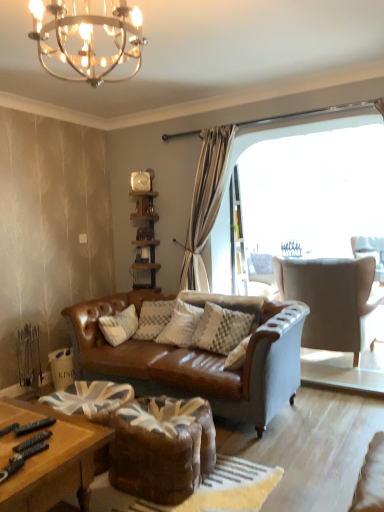
Question: Is suede-like beige armchair at right turned away from wooden polished coffee table at lower left?

Choices:
 (A) yes
 (B) no

Answer: (A)

Question: From a real-world perspective, is suede-like beige armchair at right physically above wooden polished coffee table at lower left?

Choices:
 (A) no
 (B) yes

Answer: (B)

Question: Is suede-like beige armchair at right shorter than wooden polished coffee table at lower left?

Choices:
 (A) no
 (B) yes

Answer: (A)

Question: Is suede-like beige armchair at right smaller than wooden polished coffee table at lower left?

Choices:
 (A) yes
 (B) no

Answer: (B)

Question: Is suede-like beige armchair at right not close to wooden polished coffee table at lower left?

Choices:
 (A) no
 (B) yes

Answer: (B)

Question: Is suede-like beige armchair at right with wooden polished coffee table at lower left?

Choices:
 (A) yes
 (B) no

Answer: (B)

Question: Does wooden polished coffee table at lower left lie in front of woodenshelf at center?

Choices:
 (A) yes
 (B) no

Answer: (A)

Question: Considering the relative sizes of wooden polished coffee table at lower left and woodenshelf at center in the image provided, is wooden polished coffee table at lower left shorter than woodenshelf at center?

Choices:
 (A) yes
 (B) no

Answer: (A)

Question: Can you confirm if wooden polished coffee table at lower left is smaller than woodenshelf at center?

Choices:
 (A) yes
 (B) no

Answer: (B)

Question: Is wooden polished coffee table at lower left outside of woodenshelf at center?

Choices:
 (A) no
 (B) yes

Answer: (B)

Question: Does wooden polished coffee table at lower left have a lesser width compared to woodenshelf at center?

Choices:
 (A) no
 (B) yes

Answer: (A)

Question: Would you say wooden polished coffee table at lower left contains woodenshelf at center?

Choices:
 (A) no
 (B) yes

Answer: (A)

Question: Is woodenshelf at center positioned far away from leather swivel chair at center?

Choices:
 (A) no
 (B) yes

Answer: (B)